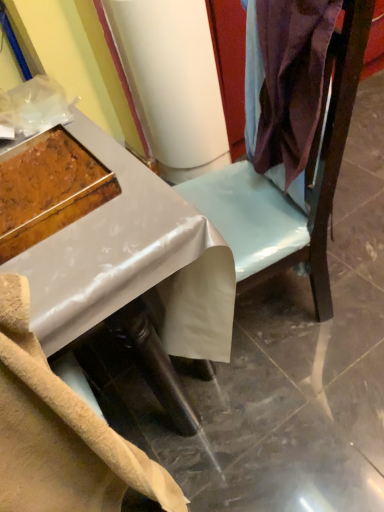
Question: From the image's perspective, is wooden tray at left positioned above or below satin purple fabric at upper right?

Choices:
 (A) below
 (B) above

Answer: (A)

Question: Does point (13, 188) appear closer or farther from the camera than point (279, 265)?

Choices:
 (A) farther
 (B) closer

Answer: (B)

Question: Based on their relative distances, which object is nearer to the wooden tray at left?

Choices:
 (A) satin purple fabric at upper right
 (B) white glossy desk at center

Answer: (B)

Question: Based on their relative distances, which object is farther from the wooden tray at left?

Choices:
 (A) satin purple fabric at upper right
 (B) white glossy desk at center

Answer: (A)